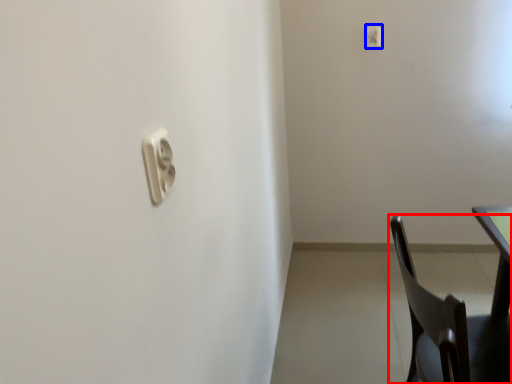
Question: Which object appears closest to the camera in this image, chair (highlighted by a red box) or light switch (highlighted by a blue box)?

Choices:
 (A) chair
 (B) light switch

Answer: (A)